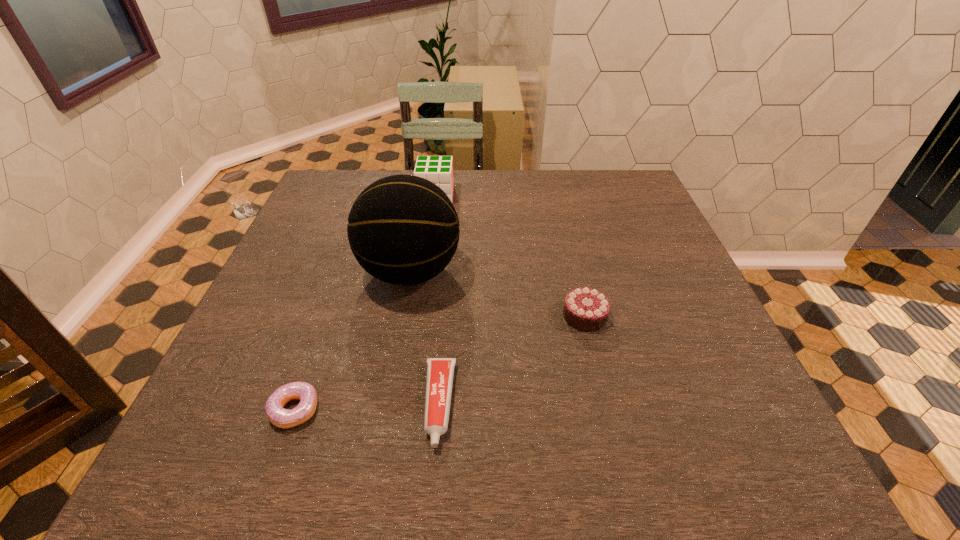
Where is `vacant space at the far right corner`? This screenshot has height=540, width=960. vacant space at the far right corner is located at coordinates (600, 176).

At what (x,y) coordinates should I click in order to perform the action: click on free area in between the toothpaste and the third tallest object. Please return your answer as a coordinate pair (x, y). This screenshot has width=960, height=540. Looking at the image, I should click on (512, 360).

I want to click on empty space between the tallest object and the rightmost object, so click(x=497, y=294).

Where is `free space between the second tallest object and the third tallest object`? The height and width of the screenshot is (540, 960). free space between the second tallest object and the third tallest object is located at coordinates (510, 255).

You are a GUI agent. You are given a task and a screenshot of the screen. Output one action in this format:
    pyautogui.click(x=<x>, y=<y>)
    Task: Click on the free area in between the toothpaste and the doughnut
    The width and height of the screenshot is (960, 540).
    Given the screenshot: What is the action you would take?
    pyautogui.click(x=367, y=407)

Find the location of a particular element. This screenshot has height=540, width=960. vacant region between the toothpaste and the tallest object is located at coordinates (424, 338).

The image size is (960, 540). I want to click on free point between the chocolate cake and the farthest object, so click(510, 255).

Where is `free spot between the doughnut and the tallest object`? The width and height of the screenshot is (960, 540). free spot between the doughnut and the tallest object is located at coordinates (352, 341).

Find the location of a particular element. The height and width of the screenshot is (540, 960). free spot between the toothpaste and the doughnut is located at coordinates (367, 407).

Locate an element on the screen. This screenshot has width=960, height=540. object that is the second closest one to the third shortest object is located at coordinates (440, 371).